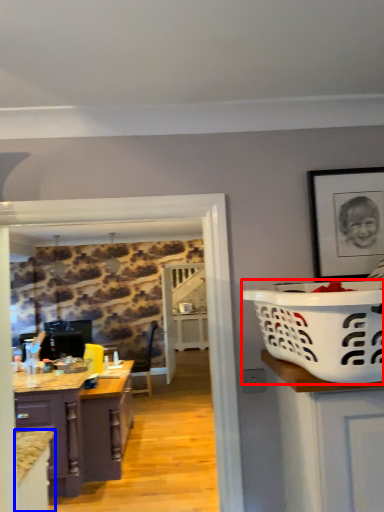
Question: Among these objects, which one is farthest to the camera, basket container (highlighted by a red box) or cabinetry (highlighted by a blue box)?

Choices:
 (A) basket container
 (B) cabinetry

Answer: (B)